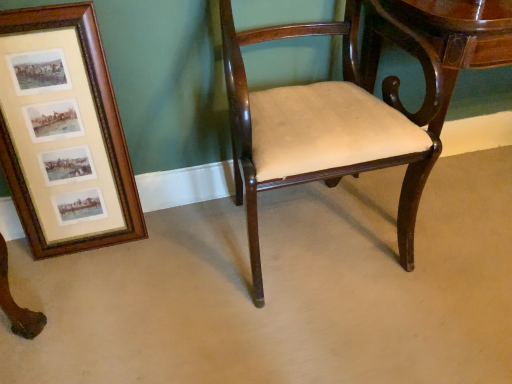
Question: Considering the relative sizes of wooden frame at left and mahogany wood chair at center in the image provided, is wooden frame at left wider than mahogany wood chair at center?

Choices:
 (A) no
 (B) yes

Answer: (A)

Question: Is wooden frame at left bigger than mahogany wood chair at center?

Choices:
 (A) yes
 (B) no

Answer: (B)

Question: Does wooden frame at left have a smaller size compared to mahogany wood chair at center?

Choices:
 (A) yes
 (B) no

Answer: (A)

Question: Is wooden frame at left taller than mahogany wood chair at center?

Choices:
 (A) yes
 (B) no

Answer: (B)

Question: Is wooden frame at left outside of mahogany wood chair at center?

Choices:
 (A) yes
 (B) no

Answer: (A)

Question: From a real-world perspective, is mahogany wood chair at center positioned above or below glossy wood table at center?

Choices:
 (A) above
 (B) below

Answer: (A)

Question: Considering the positions of point (320, 132) and point (380, 163), is point (320, 132) closer or farther from the camera than point (380, 163)?

Choices:
 (A) farther
 (B) closer

Answer: (B)

Question: Considering the relative positions of mahogany wood chair at center and glossy wood table at center in the image provided, is mahogany wood chair at center to the left or to the right of glossy wood table at center?

Choices:
 (A) left
 (B) right

Answer: (A)

Question: In terms of width, does mahogany wood chair at center look wider or thinner when compared to glossy wood table at center?

Choices:
 (A) wide
 (B) thin

Answer: (A)

Question: Is glossy wood table at center bigger or smaller than mahogany wood chair at center?

Choices:
 (A) big
 (B) small

Answer: (A)

Question: Looking at their shapes, would you say glossy wood table at center is wider or thinner than mahogany wood chair at center?

Choices:
 (A) wide
 (B) thin

Answer: (B)

Question: Considering the positions of point (433, 44) and point (398, 225), is point (433, 44) closer or farther from the camera than point (398, 225)?

Choices:
 (A) closer
 (B) farther

Answer: (A)

Question: From a real-world perspective, is glossy wood table at center positioned above or below mahogany wood chair at center?

Choices:
 (A) above
 (B) below

Answer: (B)

Question: In the image, is wooden frame at left on the left side or the right side of glossy wood table at center?

Choices:
 (A) left
 (B) right

Answer: (A)

Question: Is wooden frame at left wider or thinner than glossy wood table at center?

Choices:
 (A) wide
 (B) thin

Answer: (B)